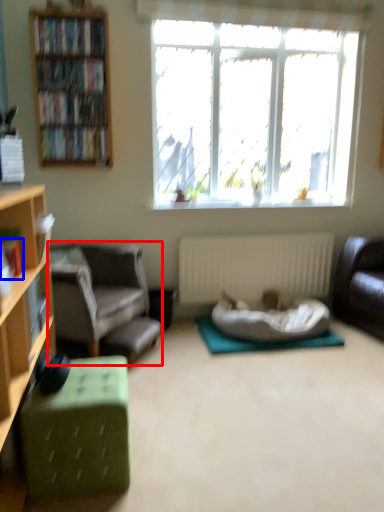
Question: Which object is further to the camera taking this photo, chair (highlighted by a red box) or book (highlighted by a blue box)?

Choices:
 (A) chair
 (B) book

Answer: (A)